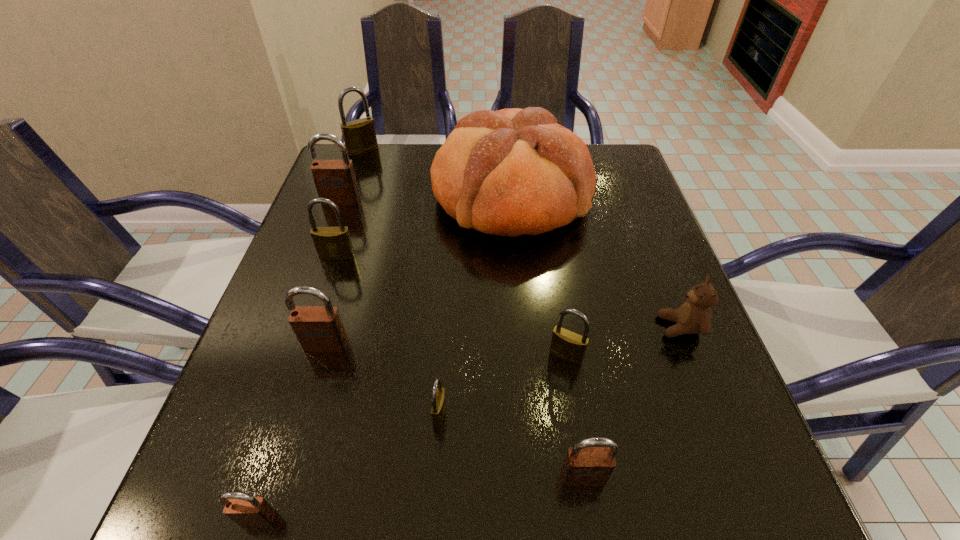
Where is `empty space that is in between the third nearest brass padlock and the nearest padlock`? The image size is (960, 540). empty space that is in between the third nearest brass padlock and the nearest padlock is located at coordinates (298, 387).

The image size is (960, 540). I want to click on vacant space that's between the biggest brown padlock and the third brass padlock from left to right, so click(x=391, y=308).

This screenshot has height=540, width=960. Find the location of `free spot between the second farthest brass padlock and the second nearest padlock`. free spot between the second farthest brass padlock and the second nearest padlock is located at coordinates (460, 366).

Image resolution: width=960 pixels, height=540 pixels. I want to click on empty space between the biggest brown padlock and the third smallest brown padlock, so click(333, 273).

Where is `empty space that is in between the teddy bear and the third smallest brass padlock`? empty space that is in between the teddy bear and the third smallest brass padlock is located at coordinates (509, 291).

Locate an element on the screen. Image resolution: width=960 pixels, height=540 pixels. empty space that is in between the teddy bear and the second farthest brown padlock is located at coordinates (503, 336).

Where is `free space between the third nearest brown padlock and the third nearest object`? The height and width of the screenshot is (540, 960). free space between the third nearest brown padlock and the third nearest object is located at coordinates (383, 380).

Choose which object is the fifth nearest neighbor to the nearest padlock. Please provide its 2D coordinates. Your answer should be formatted as a tuple, i.e. [(x, y)], where the tuple contains the x and y coordinates of a point satisfying the conditions above.

[(332, 243)]

The width and height of the screenshot is (960, 540). In order to click on object that is the fourth closest to the rightmost brass padlock in this screenshot , I will do `click(510, 172)`.

Locate which padlock ranks third in proximity to the nearest padlock. Please provide its 2D coordinates. Your answer should be formatted as a tuple, i.e. [(x, y)], where the tuple contains the x and y coordinates of a point satisfying the conditions above.

[(583, 466)]